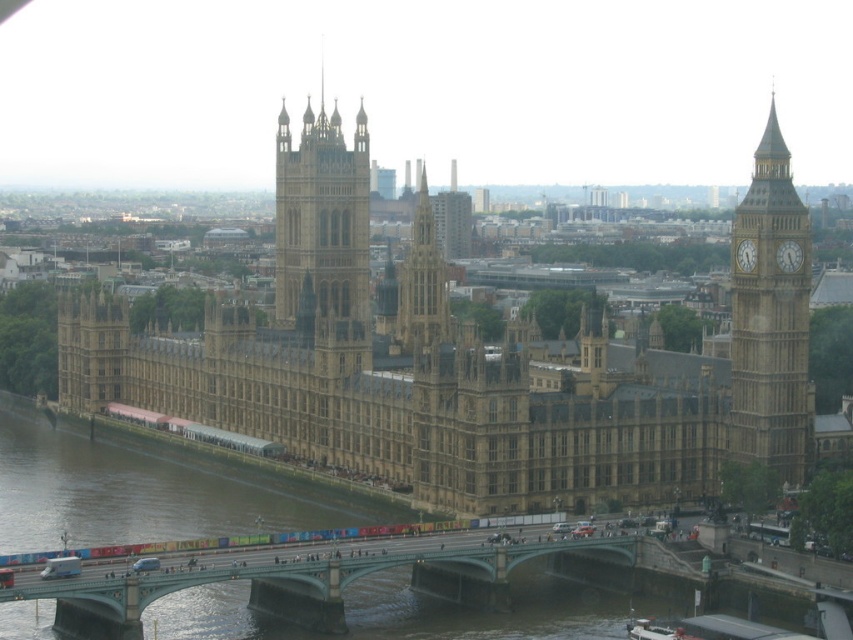
Question: Does golden stone clock tower at right appear on the right side of golden stone tower at center?

Choices:
 (A) yes
 (B) no

Answer: (A)

Question: Can you confirm if gold metallic clock at right is positioned above gold textured clock at right?

Choices:
 (A) no
 (B) yes

Answer: (A)

Question: Which of these objects is positioned farthest from the golden stone building at center?

Choices:
 (A) golden stone clock tower at right
 (B) green painted metal bridge at center

Answer: (B)

Question: Does golden stone building at center appear over golden stone tower at center?

Choices:
 (A) no
 (B) yes

Answer: (A)

Question: Which of the following is the closest to the observer?

Choices:
 (A) (732, 244)
 (B) (776, 307)

Answer: (B)

Question: Which of the following is the closest to the observer?

Choices:
 (A) (473, 576)
 (B) (782, 266)

Answer: (A)